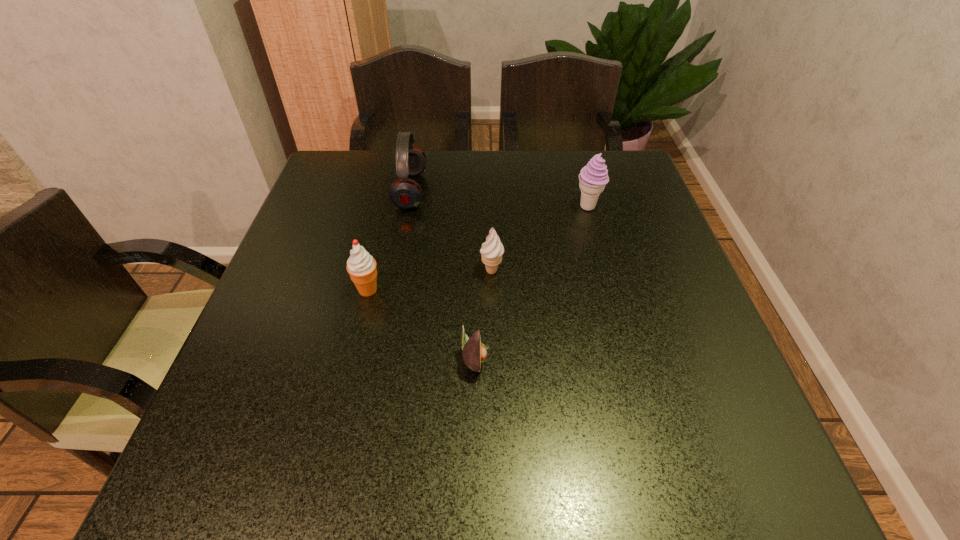
Identify the location of free region located on the left of the rightmost icecream. (555, 207).

Locate an element on the screen. This screenshot has height=540, width=960. vacant space located 0.120m on the back of the nearest icecream is located at coordinates (379, 244).

You are a GUI agent. You are given a task and a screenshot of the screen. Output one action in this format:
    pyautogui.click(x=<x>, y=<y>)
    Task: Click on the blank space located 0.120m on the front-facing side of the third farthest object
    This screenshot has width=960, height=540.
    Given the screenshot: What is the action you would take?
    pyautogui.click(x=426, y=271)

Image resolution: width=960 pixels, height=540 pixels. What are the coordinates of `vacant space located on the front-facing side of the third farthest object` in the screenshot? It's located at (377, 271).

Find the location of `vacant space located 0.190m on the front-facing side of the third farthest object`. vacant space located 0.190m on the front-facing side of the third farthest object is located at coordinates (396, 271).

Locate an element on the screen. vacant space situated on the seed side of the shortest object is located at coordinates (552, 357).

Identify the location of object located in the far edge section of the desktop. This screenshot has width=960, height=540. (405, 193).

Identify the location of object that is positioned at the right edge. Image resolution: width=960 pixels, height=540 pixels. (593, 177).

This screenshot has height=540, width=960. In the image, there is a desktop. Find the location of `free space at the far edge`. free space at the far edge is located at coordinates point(564,177).

Identify the location of free region at the near edge of the desktop. This screenshot has width=960, height=540. [636, 460].